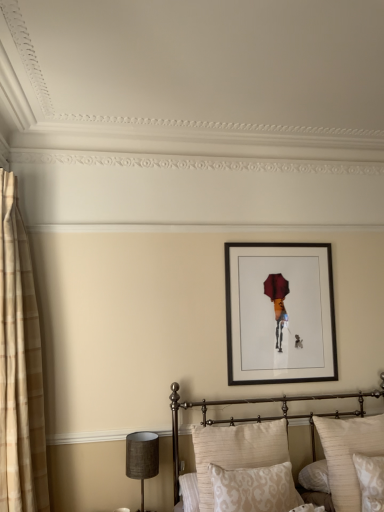
Question: Is black matte picture frame at upper center oriented towards beige damask pillow at lower center, arranged as the second pillow when viewed from the left?

Choices:
 (A) no
 (B) yes

Answer: (A)

Question: Would you say black matte picture frame at upper center contains beige damask pillow at lower center, the third pillow positioned from the right?

Choices:
 (A) yes
 (B) no

Answer: (B)

Question: Are black matte picture frame at upper center and beige damask pillow at lower center, the third pillow positioned from the right, far apart?

Choices:
 (A) yes
 (B) no

Answer: (B)

Question: Does black matte picture frame at upper center touch beige damask pillow at lower center, arranged as the second pillow when viewed from the left?

Choices:
 (A) yes
 (B) no

Answer: (B)

Question: Is black matte picture frame at upper center looking in the opposite direction of beige damask pillow at lower center, the third pillow positioned from the right?

Choices:
 (A) yes
 (B) no

Answer: (B)

Question: Can you confirm if black matte picture frame at upper center is shorter than beige damask pillow at lower center, arranged as the second pillow when viewed from the left?

Choices:
 (A) no
 (B) yes

Answer: (A)

Question: Is metallic gold bed at center wider than beige plaid curtain at left?

Choices:
 (A) no
 (B) yes

Answer: (B)

Question: Does metallic gold bed at center have a greater height compared to beige plaid curtain at left?

Choices:
 (A) no
 (B) yes

Answer: (A)

Question: From the image's perspective, is metallic gold bed at center beneath beige plaid curtain at left?

Choices:
 (A) no
 (B) yes

Answer: (B)

Question: From a real-world perspective, is metallic gold bed at center below beige plaid curtain at left?

Choices:
 (A) yes
 (B) no

Answer: (A)

Question: Is metallic gold bed at center not inside beige plaid curtain at left?

Choices:
 (A) yes
 (B) no

Answer: (A)

Question: Considering the relative sizes of metallic gold bed at center and beige plaid curtain at left in the image provided, is metallic gold bed at center shorter than beige plaid curtain at left?

Choices:
 (A) yes
 (B) no

Answer: (A)

Question: From a real-world perspective, does neutral fabric pillow at center, the first pillow viewed from the left, stand above beige textured pillow at lower right, the 1th pillow when ordered from right to left?

Choices:
 (A) yes
 (B) no

Answer: (A)